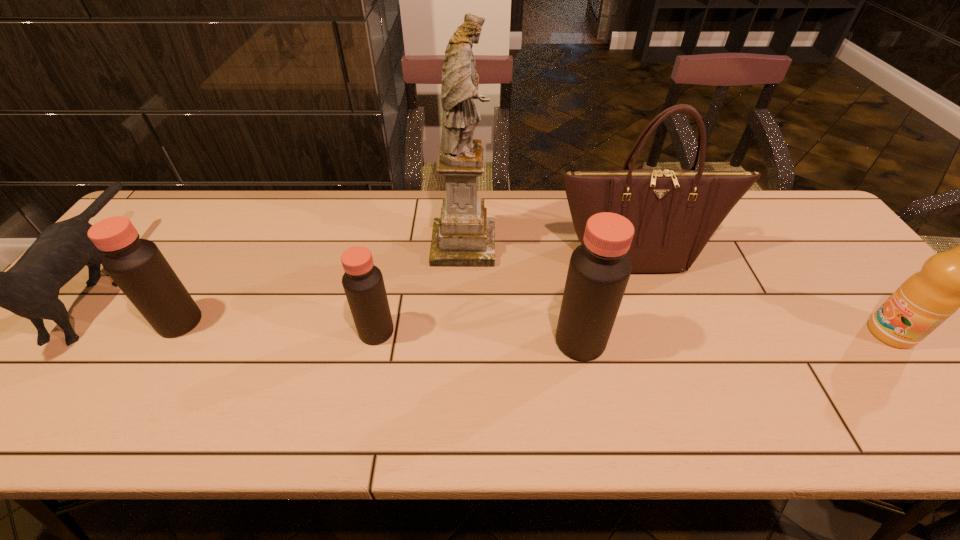
Please point a spot on the right to add another vinegar. Please provide its 2D coordinates. Your answer should be formatted as a tuple, i.e. [(x, y)], where the tuple contains the x and y coordinates of a point satisfying the conditions above.

[(792, 352)]